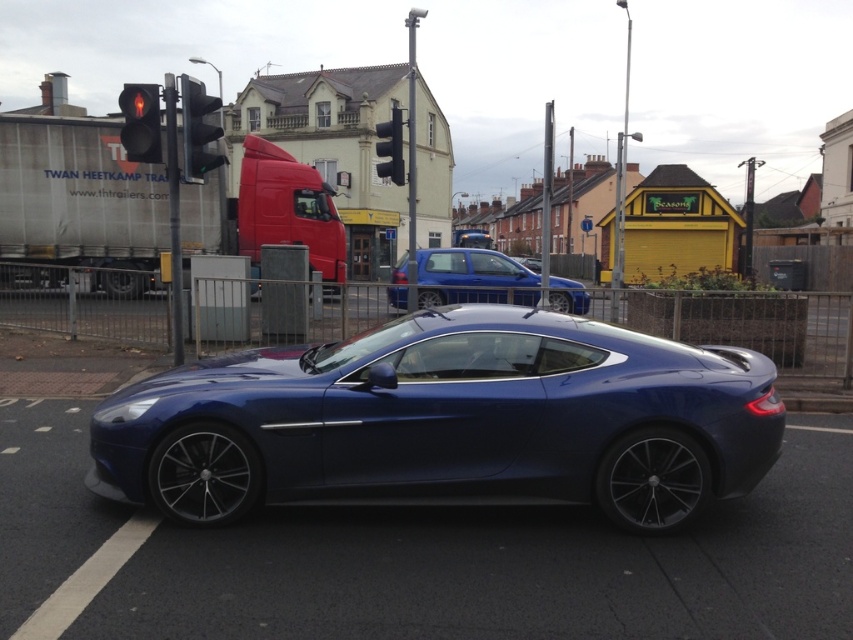
Question: Is red glass traffic light at upper left smaller than metallic traffic light at center?

Choices:
 (A) no
 (B) yes

Answer: (A)

Question: Based on their relative distances, which object is farther from the metallic traffic light at upper center?

Choices:
 (A) metallic traffic light at center
 (B) glossy blue sports car at center
 (C) red glass traffic light at upper left
 (D) matte blue hatchback at center

Answer: (A)

Question: Which is nearer to the glossy blue sports car at center?

Choices:
 (A) matte blue hatchback at center
 (B) metallic traffic light at upper center
 (C) metallic traffic light at center
 (D) red glass traffic light at upper left

Answer: (B)

Question: Does glossy blue sports car at center appear over metallic traffic light at center?

Choices:
 (A) no
 (B) yes

Answer: (A)

Question: Is matte blue hatchback at center wider than metallic traffic light at upper center?

Choices:
 (A) yes
 (B) no

Answer: (A)

Question: Which point is closer to the camera?

Choices:
 (A) (535, 272)
 (B) (637, 458)
 (C) (128, 106)
 (D) (402, 157)

Answer: (B)